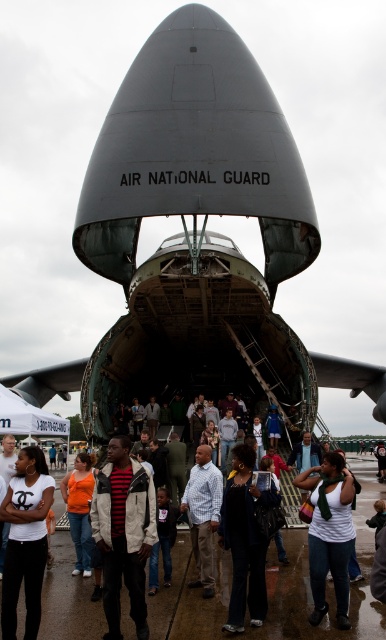
You are a photographer trying to capture a wide shot of the shiny asphalt tarmac at center and the orange fabric shirt at lower left. Which object should you focus on first if you want to include both in the frame without zooming?

The shiny asphalt tarmac at center is larger in size than the orange fabric shirt at lower left, so focusing on the shiny asphalt tarmac at center first will ensure it fits properly in the frame before adjusting for the smaller orange fabric shirt at lower left.

You are standing at the point marked by coordinates point (326, 582). Looking around, what surface are you standing on?

You are standing on the shiny asphalt tarmac at center marked by point (326, 582).